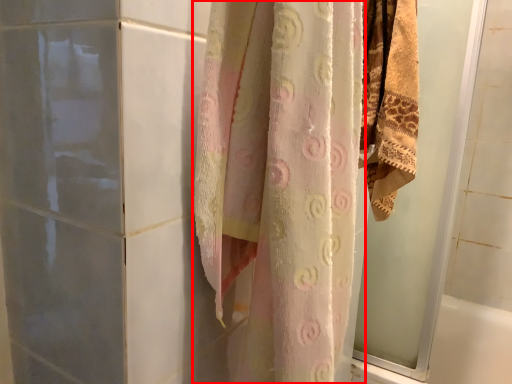
Question: From the image's perspective, what is the correct spatial relationship of curtain (annotated by the red box) in relation to screen door?

Choices:
 (A) below
 (B) above

Answer: (A)